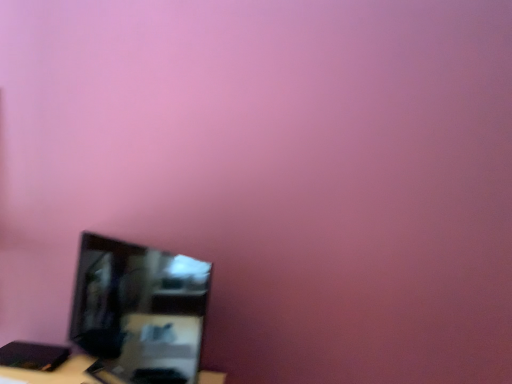
Locate an element on the screen. matte black monitor at lower left is located at coordinates (140, 310).

Describe the element at coordinates (140, 310) in the screenshot. I see `matte black monitor at lower left` at that location.

Where is `matte black monitor at lower left`? This screenshot has height=384, width=512. matte black monitor at lower left is located at coordinates (140, 310).